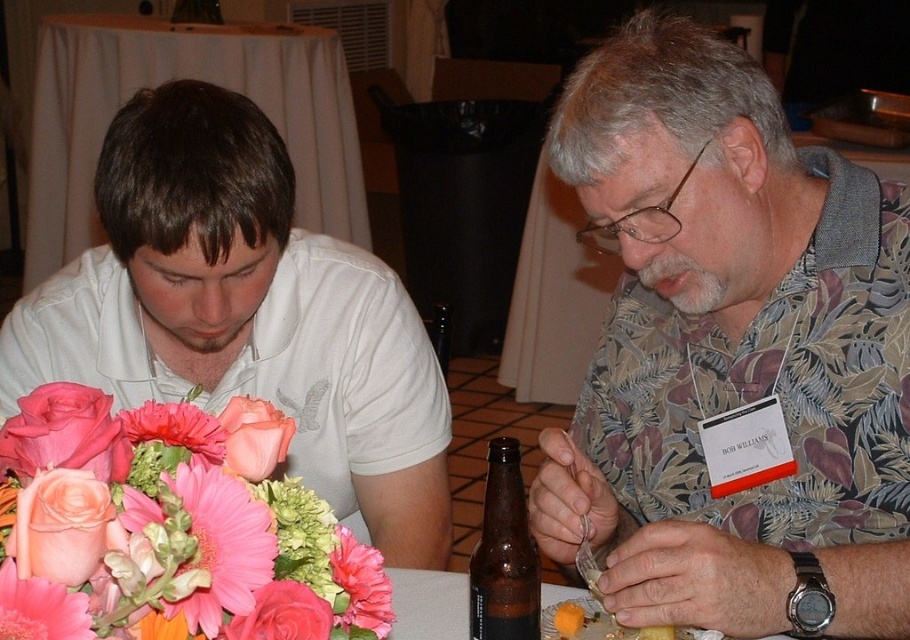
Question: Which of these objects is positioned farthest from the pink matte gerbera at center?

Choices:
 (A) orange cheese at lower center
 (B) white fabric table at lower left

Answer: (B)

Question: Does matte white shirt at center appear on the left side of pink matte gerbera at center?

Choices:
 (A) yes
 (B) no

Answer: (A)

Question: Among these points, which one is nearest to the camera?

Choices:
 (A) (560, 616)
 (B) (59, 212)
 (C) (538, 342)
 (D) (275, 625)

Answer: (D)

Question: Is white fabric table at lower left positioned behind pink matte flower at center?

Choices:
 (A) yes
 (B) no

Answer: (A)

Question: Does pink matte flower at center appear over orange cheese at lower center?

Choices:
 (A) no
 (B) yes

Answer: (B)

Question: Which point is farther from the camera taking this photo?

Choices:
 (A) (153, 376)
 (B) (275, 588)
 (C) (76, 634)
 (D) (270, 433)

Answer: (A)